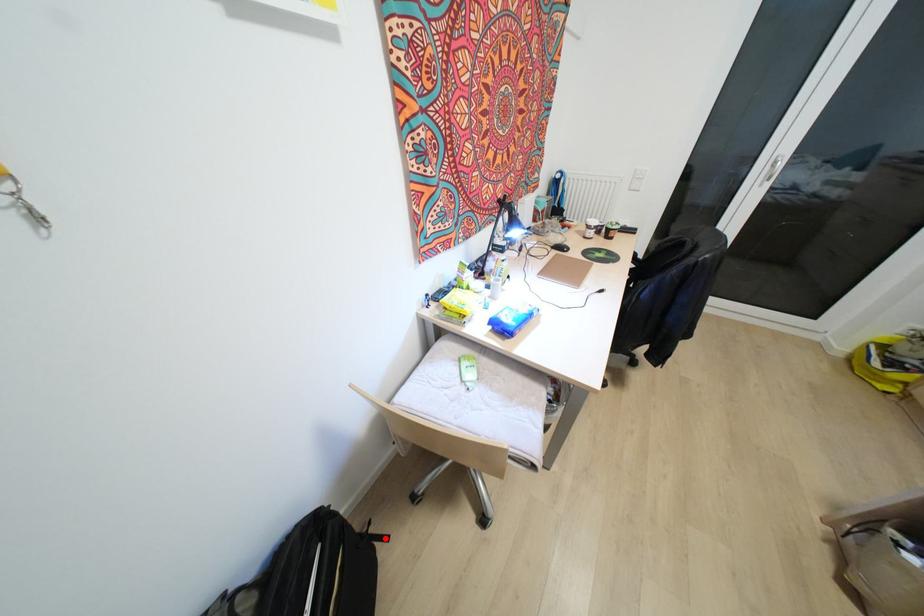
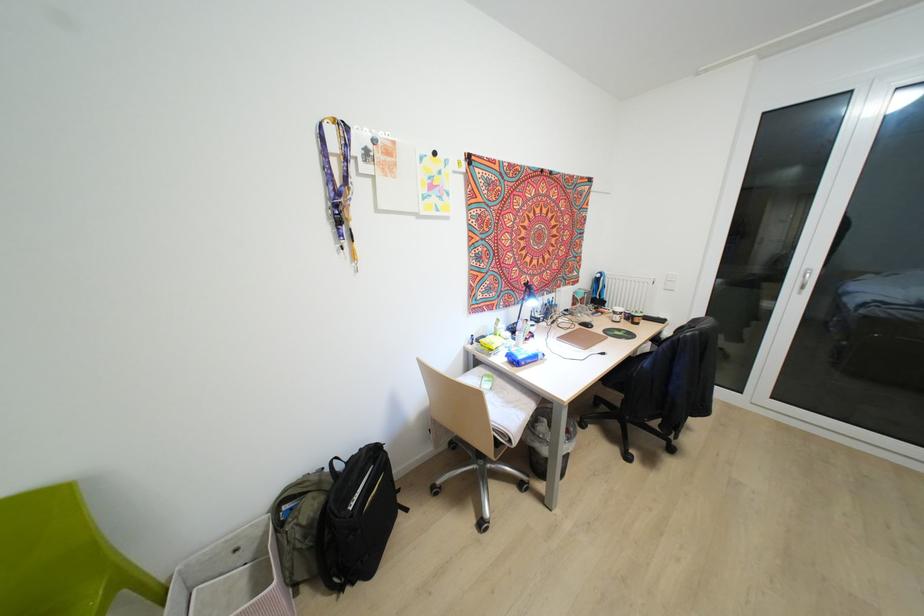
Question: I am providing you with two images of the same scene from different viewpoints. Given a red point in image1, look at the same physical point in image2. Is it:

Choices:
 (A) Closer to the viewpoint
 (B) Farther from the viewpoint

Answer: (B)